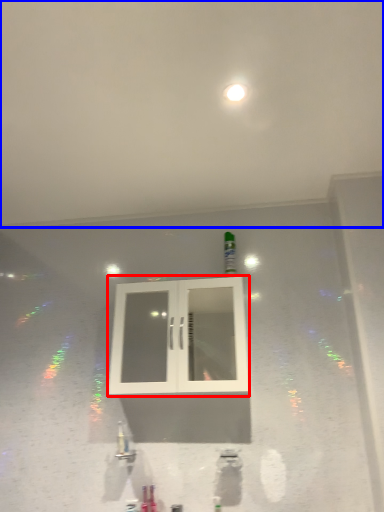
Question: Which of the following is the closest to the observer, window (highlighted by a red box) or backdrop (highlighted by a blue box)?

Choices:
 (A) window
 (B) backdrop

Answer: (B)